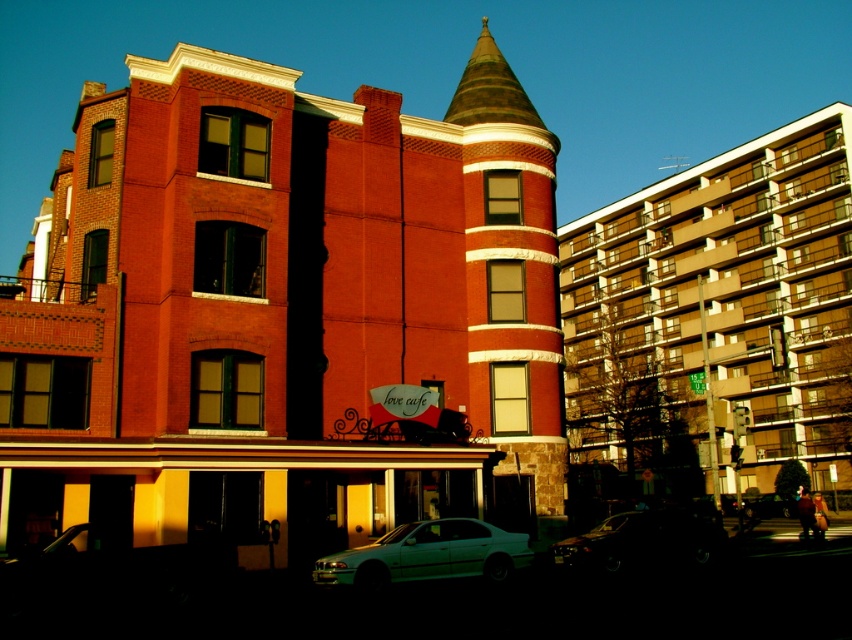
Is point (384, 586) positioned behind point (648, 528)?

That is False.

The height and width of the screenshot is (640, 852). I want to click on white glossy sedan at lower center, so click(427, 556).

Between point (441, 524) and point (665, 545), which one is positioned behind?

The point (665, 545) is behind.

This screenshot has width=852, height=640. Identify the location of white glossy sedan at lower center. (427, 556).

How much distance is there between white glossy sedan at lower center and metallic silver sedan at center?

white glossy sedan at lower center is 182.19 feet from metallic silver sedan at center.

Between white glossy sedan at lower center and metallic silver sedan at center, which one appears on the right side from the viewer's perspective?

metallic silver sedan at center

Who is more forward, (399, 576) or (747, 506)?

Positioned in front is point (399, 576).

In order to click on white glossy sedan at lower center in this screenshot , I will do `click(427, 556)`.

Between point (632, 552) and point (781, 497), which one is positioned in front?

Point (632, 552) is more forward.

Between point (717, 529) and point (761, 508), which one is positioned behind?

The point (761, 508) is behind.

Locate an element on the screen. The image size is (852, 640). shiny black sedan at lower center is located at coordinates (643, 541).